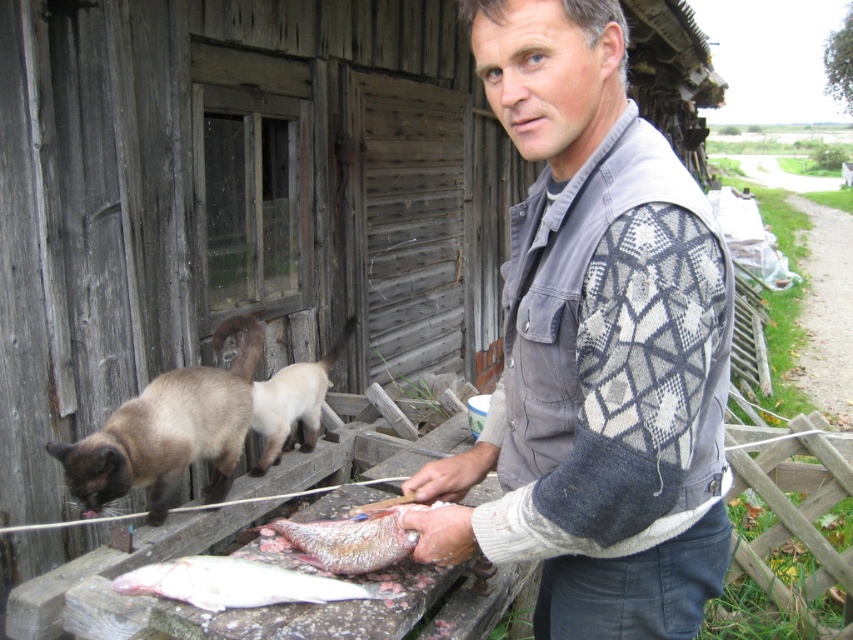
Between point (616, 428) and point (154, 476), which one is positioned in front?

Point (616, 428)

Is gray sweater at center below siamese fur cat at left?

Incorrect, gray sweater at center is not positioned below siamese fur cat at left.

This screenshot has width=853, height=640. In order to click on gray sweater at center in this screenshot , I will do `click(595, 348)`.

Does siamese fur cat at left lie in front of brown fur cat at center?

That is True.

Does siamese fur cat at left appear on the right side of brown fur cat at center?

No, siamese fur cat at left is not to the right of brown fur cat at center.

Is point (212, 387) positioned before point (212, 349)?

Yes, it is.

I want to click on siamese fur cat at left, so tap(169, 432).

Looking at this image, can you confirm if siamese fur cat at left is positioned to the left of white fleshed fish at lower center?

Indeed, siamese fur cat at left is positioned on the left side of white fleshed fish at lower center.

Does siamese fur cat at left have a lesser height compared to white fleshed fish at lower center?

In fact, siamese fur cat at left may be taller than white fleshed fish at lower center.

Does point (215, 340) lie behind point (120, 586)?

Yes, point (215, 340) is farther from viewer.

At what (x,y) coordinates should I click in order to perform the action: click on siamese fur cat at left. Please return your answer as a coordinate pair (x, y). Looking at the image, I should click on (169, 432).